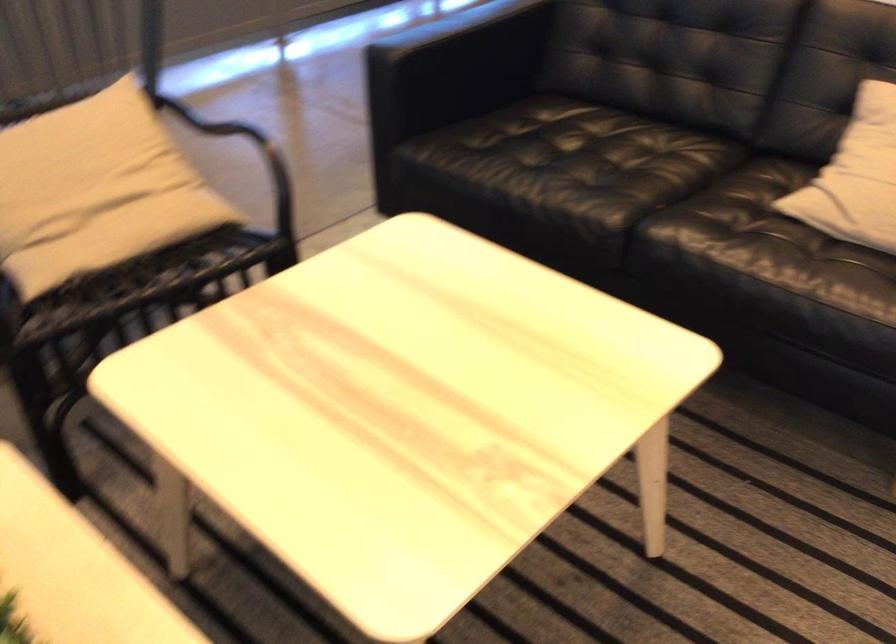
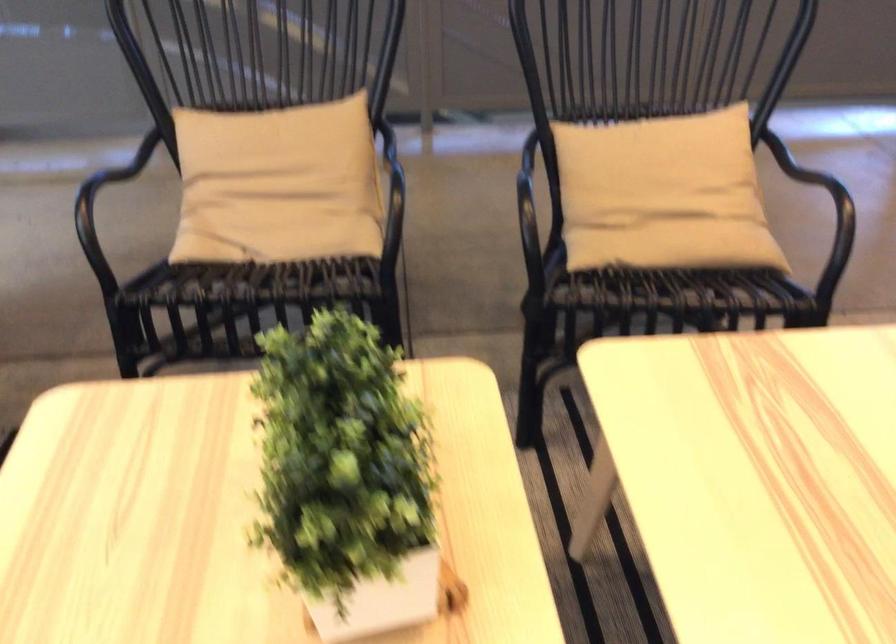
In the second image, find the point that corresponds to (91,189) in the first image.

(662, 194)